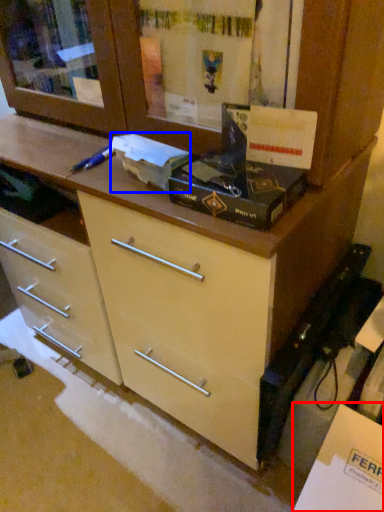
Question: Which object is further to the camera taking this photo, cabinetry (highlighted by a red box) or box (highlighted by a blue box)?

Choices:
 (A) cabinetry
 (B) box

Answer: (B)